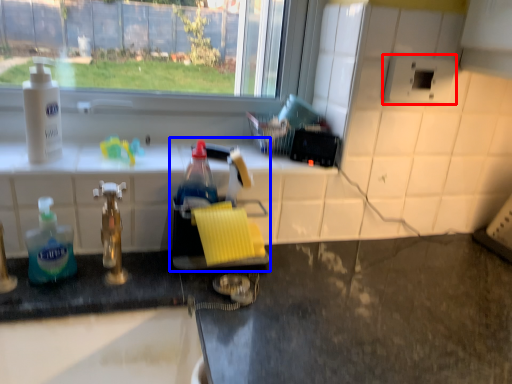
Question: Which object is closer to the camera taking this photo, appliance (highlighted by a red box) or sink (highlighted by a blue box)?

Choices:
 (A) appliance
 (B) sink

Answer: (B)